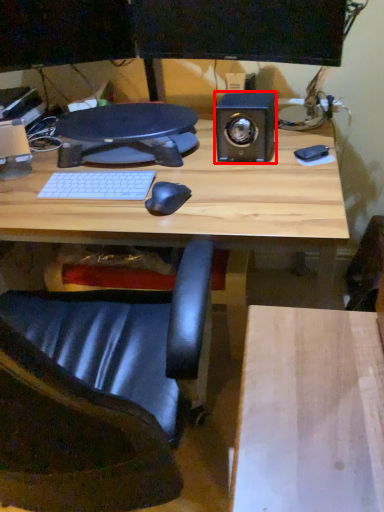
Question: Considering the relative positions of speaker (annotated by the red box) and chair in the image provided, where is speaker (annotated by the red box) located with respect to the staircase?

Choices:
 (A) right
 (B) left

Answer: (A)